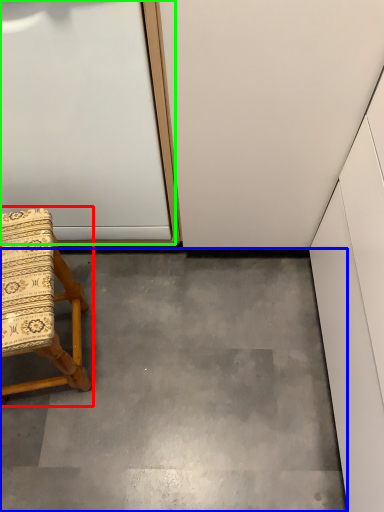
Question: Which is farther away from chair (highlighted by a red box)? concrete (highlighted by a blue box) or door (highlighted by a green box)?

Choices:
 (A) concrete
 (B) door

Answer: (A)